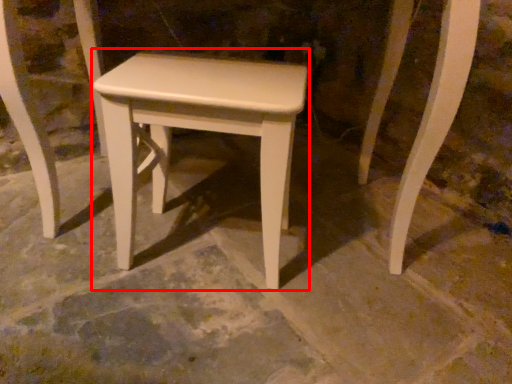
Question: Observing the image, what is the correct spatial positioning of stool (annotated by the red box) in reference to concrete?

Choices:
 (A) right
 (B) left

Answer: (B)